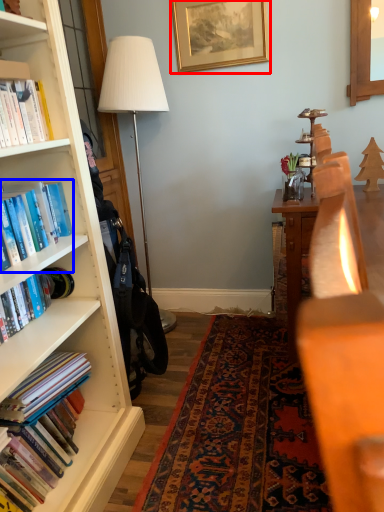
Question: Which object is further to the camera taking this photo, picture frame (highlighted by a red box) or book (highlighted by a blue box)?

Choices:
 (A) picture frame
 (B) book

Answer: (A)